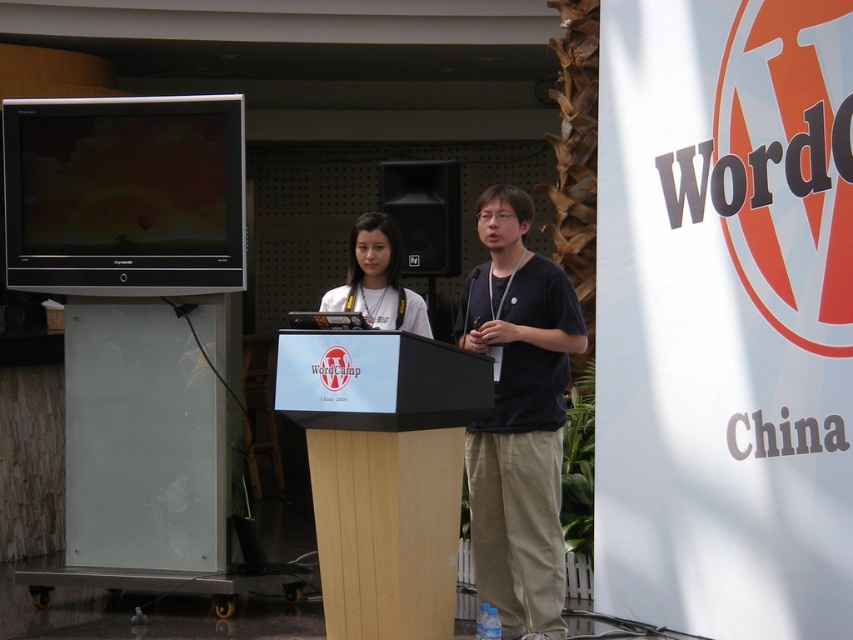
Question: Which of the following is the closest to the observer?

Choices:
 (A) (468, 282)
 (B) (351, 275)
 (C) (312, 461)

Answer: (C)

Question: Does light brown wood podium at center appear on the left side of black matte shirt at center?

Choices:
 (A) no
 (B) yes

Answer: (B)

Question: Which point is farther from the camera taking this photo?

Choices:
 (A) (532, 618)
 (B) (392, 291)

Answer: (B)

Question: Can you confirm if light brown wood podium at center is positioned below matte white shirt at center?

Choices:
 (A) yes
 (B) no

Answer: (A)

Question: Considering the relative positions of black matte shirt at center and matte white shirt at center in the image provided, where is black matte shirt at center located with respect to matte white shirt at center?

Choices:
 (A) left
 (B) right

Answer: (B)

Question: Which point is farther from the camera taking this photo?

Choices:
 (A) [326, 397]
 (B) [381, 301]

Answer: (B)